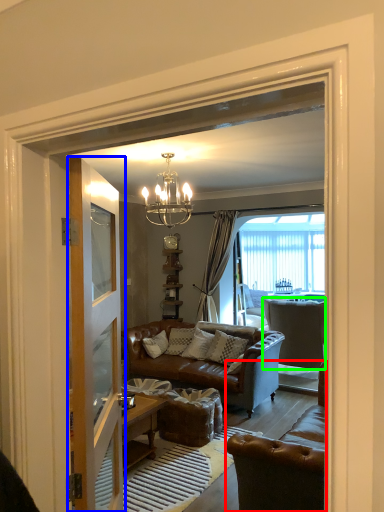
Question: Which object is positioned farthest from chair (highlighted by a red box)? Select from door (highlighted by a blue box) and chair (highlighted by a green box).

Choices:
 (A) door
 (B) chair

Answer: (B)